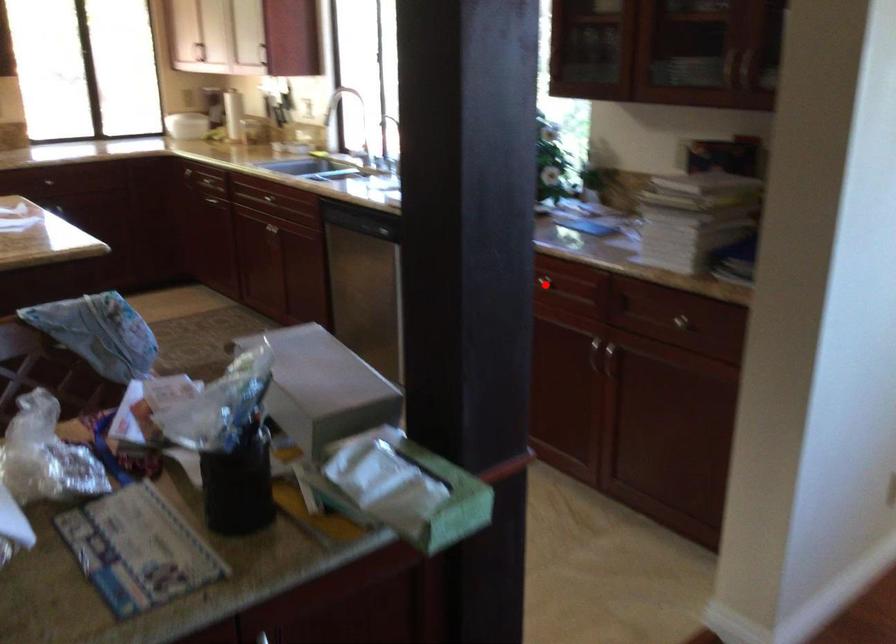
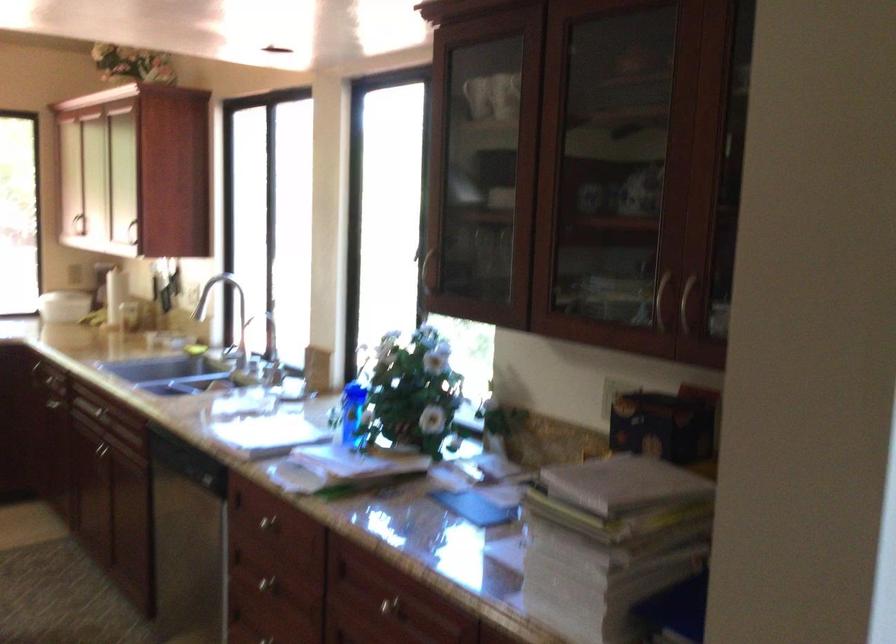
Question: I am providing you with two images of the same scene from different viewpoints. In image1, a red point is highlighted. Considering the same 3D point in image2, which of the following is correct?

Choices:
 (A) It is closer
 (B) It is farther

Answer: (A)